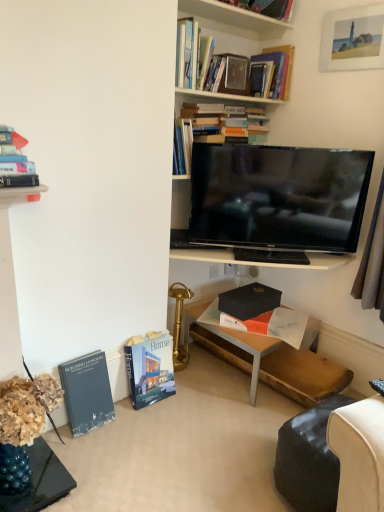
Question: Which direction should I rotate to face hardcover books at upper center, the fifth book positioned from the bottom, — up or down?

Choices:
 (A) down
 (B) up

Answer: (B)

Question: Is hardcover book at lower left, marked as the 5th book in a top-to-bottom arrangement, to the right of hardcover book at lower left, arranged as the first book when ordered from the bottom, from the viewer's perspective?

Choices:
 (A) no
 (B) yes

Answer: (B)

Question: Is hardcover book at lower left, marked as the 5th book in a top-to-bottom arrangement, positioned behind hardcover book at lower left, the 6th book viewed from the top?

Choices:
 (A) no
 (B) yes

Answer: (B)

Question: Would you say hardcover book at lower left, positioned as the second book in bottom-to-top order, is outside hardcover book at lower left, arranged as the first book when ordered from the bottom?

Choices:
 (A) yes
 (B) no

Answer: (A)

Question: From the image's perspective, does hardcover book at lower left, positioned as the second book in bottom-to-top order, appear higher than hardcover book at lower left, arranged as the first book when ordered from the bottom?

Choices:
 (A) no
 (B) yes

Answer: (B)

Question: From a real-world perspective, is hardcover book at lower left, positioned as the second book in bottom-to-top order, under hardcover book at lower left, arranged as the first book when ordered from the bottom?

Choices:
 (A) yes
 (B) no

Answer: (A)

Question: Is hardcover book at lower left, positioned as the second book in bottom-to-top order, placed right next to hardcover book at lower left, the 6th book viewed from the top?

Choices:
 (A) no
 (B) yes

Answer: (A)

Question: Considering the relative sizes of leather swivel chair at lower right and matte white picture frame at upper right in the image provided, is leather swivel chair at lower right thinner than matte white picture frame at upper right?

Choices:
 (A) yes
 (B) no

Answer: (B)

Question: Is leather swivel chair at lower right positioned far away from matte white picture frame at upper right?

Choices:
 (A) no
 (B) yes

Answer: (B)

Question: Is the position of leather swivel chair at lower right more distant than that of matte white picture frame at upper right?

Choices:
 (A) no
 (B) yes

Answer: (A)

Question: Can you confirm if leather swivel chair at lower right is smaller than matte white picture frame at upper right?

Choices:
 (A) no
 (B) yes

Answer: (A)

Question: Is leather swivel chair at lower right facing towards matte white picture frame at upper right?

Choices:
 (A) yes
 (B) no

Answer: (B)

Question: Is leather swivel chair at lower right turned away from matte white picture frame at upper right?

Choices:
 (A) no
 (B) yes

Answer: (A)

Question: Can you confirm if matte white picture frame at upper right is wider than hardcover book at upper left, arranged as the third book when viewed from the top?

Choices:
 (A) no
 (B) yes

Answer: (A)